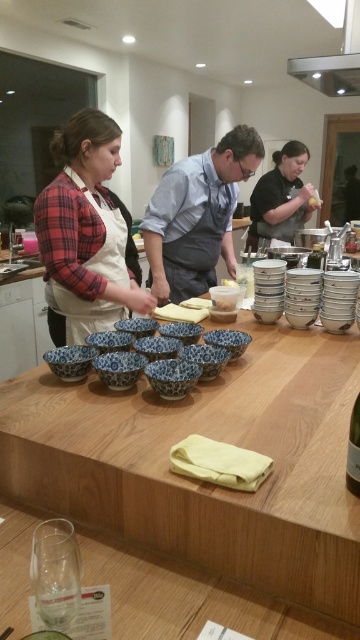
Locate an element on the screen. transparent glass at lower left is located at coordinates (56, 572).

Identify the location of transparent glass at lower left. The height and width of the screenshot is (640, 360). (56, 572).

Does point (82, 148) lie behind point (354, 464)?

Yes.

Can you confirm if plaid shirt at center is positioned to the right of clear glass bottle at center?

Incorrect, plaid shirt at center is not on the right side of clear glass bottle at center.

Is point (114, 148) behind point (357, 493)?

Yes, it is behind point (357, 493).

Where is `plaid shirt at center`? Image resolution: width=360 pixels, height=640 pixels. plaid shirt at center is located at coordinates (87, 216).

Between point (159, 193) and point (288, 74), which one is positioned in front?

Positioned in front is point (159, 193).

In the scene shown: Between blue cotton apron at center and satin silver metal exhaust hood at upper center, which one is positioned lower?

blue cotton apron at center

Is point (150, 275) behind point (295, 67)?

Yes, point (150, 275) is behind point (295, 67).

At what (x,y) coordinates should I click in order to perform the action: click on blue cotton apron at center. Please return your answer as a coordinate pair (x, y). Looking at the image, I should click on (198, 216).